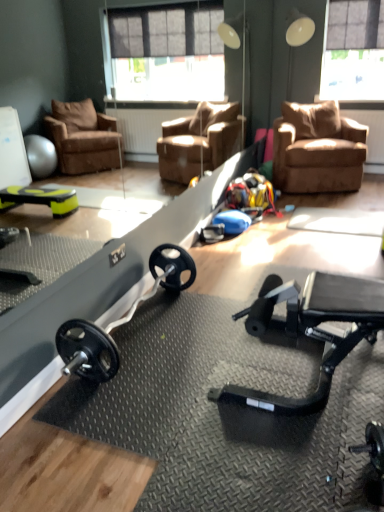
Where is `vacant region to the right of black rubber barbell at center`? The width and height of the screenshot is (384, 512). vacant region to the right of black rubber barbell at center is located at coordinates (232, 337).